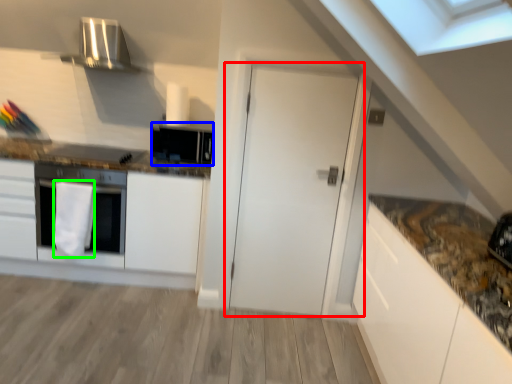
Question: Which is farther away from door (highlighted by a red box)? appliance (highlighted by a blue box) or material (highlighted by a green box)?

Choices:
 (A) appliance
 (B) material

Answer: (B)